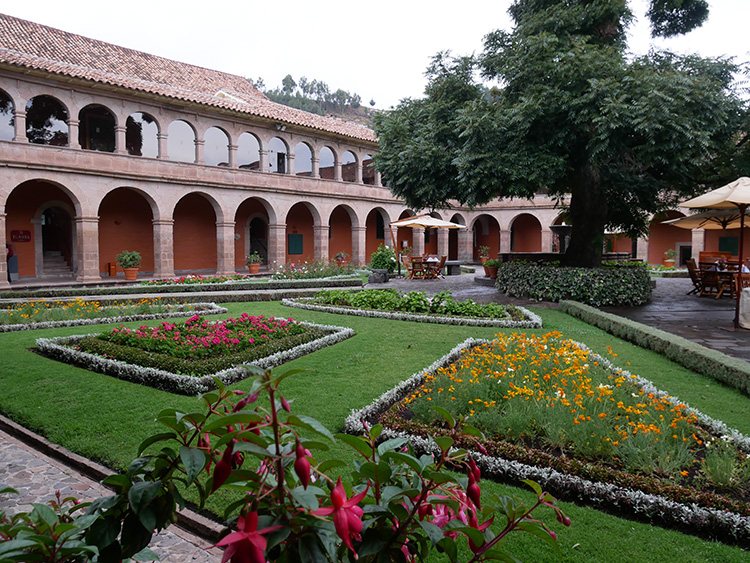
This screenshot has height=563, width=750. Find the location of `table cloth`. table cloth is located at coordinates (744, 305).